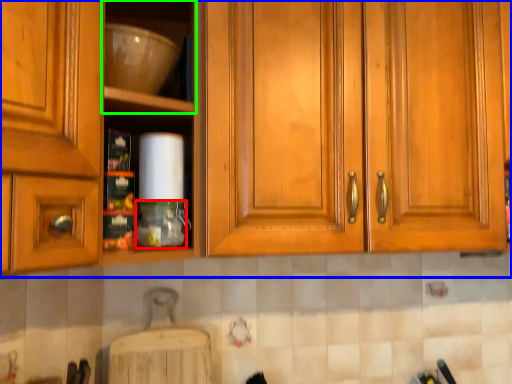
Question: Which object is the closest to the bottle (highlighted by a red box)? Choose among these: cabinetry (highlighted by a blue box) or shelf (highlighted by a green box).

Choices:
 (A) cabinetry
 (B) shelf

Answer: (A)